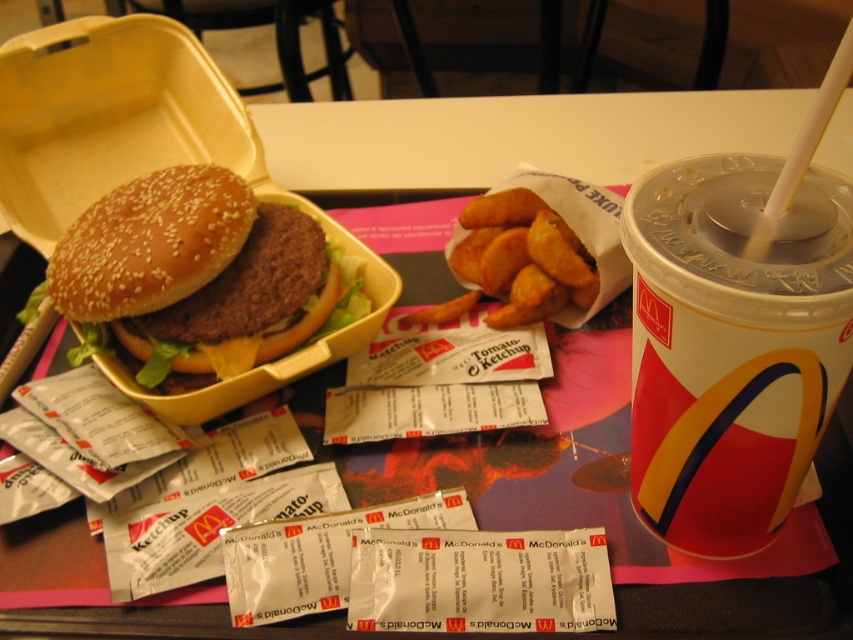
Who is taller, sesame seed bun at center or golden crispy fries at center?

With more height is sesame seed bun at center.

Is sesame seed bun at center wider than golden crispy fries at center?

Correct, the width of sesame seed bun at center exceeds that of golden crispy fries at center.

Which is behind, point (212, 288) or point (534, 221)?

The point (534, 221) is behind.

Where is `sesame seed bun at center`? The image size is (853, 640). sesame seed bun at center is located at coordinates (195, 273).

Is white plastic cup at upper right smaller than sesame seed bun at center?

Indeed, white plastic cup at upper right has a smaller size compared to sesame seed bun at center.

The image size is (853, 640). What do you see at coordinates (732, 344) in the screenshot? I see `white plastic cup at upper right` at bounding box center [732, 344].

Locate an element on the screen. white plastic cup at upper right is located at coordinates (732, 344).

Can you confirm if white plastic cup at upper right is taller than golden crispy fries at center?

Correct, white plastic cup at upper right is much taller as golden crispy fries at center.

Can you confirm if white plastic cup at upper right is shorter than golden crispy fries at center?

Incorrect, white plastic cup at upper right's height does not fall short of golden crispy fries at center's.

Locate an element on the screen. white plastic cup at upper right is located at coordinates (732, 344).